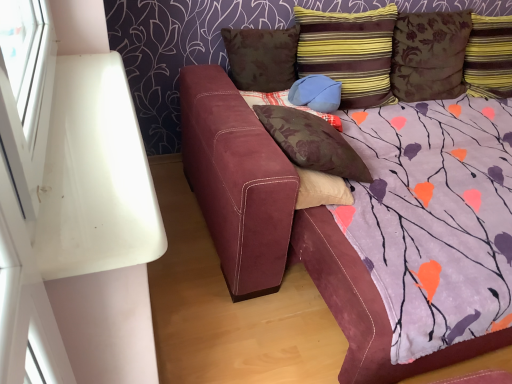
Question: Is striped fabric pillow at upper right, which appears as the first pillow when viewed from the right, taller or shorter than striped fabric pillow at upper right, the 3th pillow viewed from the right?

Choices:
 (A) tall
 (B) short

Answer: (B)

Question: In the image, is striped fabric pillow at upper right, which appears as the first pillow when viewed from the right, positioned in front of or behind striped fabric pillow at upper right, the 3th pillow viewed from the right?

Choices:
 (A) behind
 (B) front

Answer: (A)

Question: Estimate the real-world distances between objects in this image. Which object is farther from the floral fabric pillow at center, positioned as the 2th pillow in left-to-right order?

Choices:
 (A) brown floral pillow at upper right, placed as the second pillow when sorted from right to left
 (B) brown floral pillow at upper center, positioned as the sixth pillow in right-to-left order
 (C) suede couch at center
 (D) striped fabric pillow at upper right, which appears as the first pillow when viewed from the right
 (E) suede blue pillow at center, the third pillow when ordered from left to right

Answer: (D)

Question: Based on their relative distances, which object is farther from the suede couch at center?

Choices:
 (A) striped fabric pillow at upper right, the sixth pillow positioned from the left
 (B) floral fabric pillow at center, positioned as the 2th pillow in left-to-right order
 (C) brown floral pillow at upper right, placed as the second pillow when sorted from right to left
 (D) brown floral pillow at upper center, positioned as the sixth pillow in right-to-left order
 (E) striped fabric pillow at upper right, which appears as the fourth pillow when viewed from the left

Answer: (A)